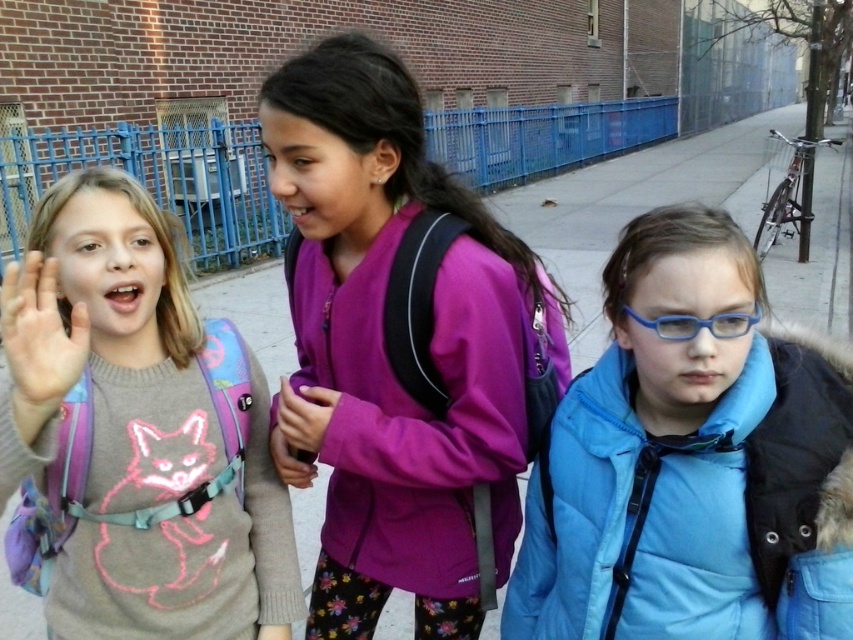
Looking at this image, is the position of matte gray sweater at left more distant than that of blue plastic glasses at center?

No, matte gray sweater at left is in front of blue plastic glasses at center.

The width and height of the screenshot is (853, 640). I want to click on matte gray sweater at left, so click(141, 428).

Where is `matte gray sweater at left`? This screenshot has height=640, width=853. matte gray sweater at left is located at coordinates (141, 428).

You are a GUI agent. You are given a task and a screenshot of the screen. Output one action in this format:
    pyautogui.click(x=<x>, y=<y>)
    Task: Click on the matte gray sweater at left
    This screenshot has height=640, width=853.
    Given the screenshot: What is the action you would take?
    point(141,428)

Is smooth skin hand at center left positioned at the back of blue plastic glasses at center?

No, it is in front of blue plastic glasses at center.

Which is more to the left, smooth skin hand at center left or blue plastic glasses at center?

From the viewer's perspective, smooth skin hand at center left appears more on the left side.

Find the location of a particular element. This screenshot has height=640, width=853. smooth skin hand at center left is located at coordinates (39, 333).

Find the location of a particular element. smooth skin hand at center left is located at coordinates (39, 333).

Who is positioned more to the left, matte pink sweater at center or blue plastic glasses at center?

Positioned to the left is matte pink sweater at center.

Does matte pink sweater at center lie in front of blue plastic glasses at center?

That is False.

The width and height of the screenshot is (853, 640). I want to click on matte pink sweater at center, so click(303, 417).

In order to click on matte pink sweater at center in this screenshot , I will do `click(303, 417)`.